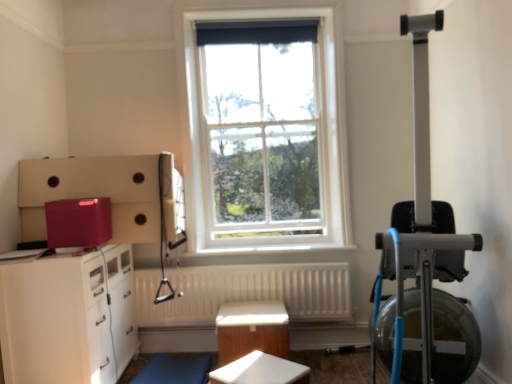
Question: Is white glossy cabinet at lower left shorter than white matte table at center, which is counted as the 2th table, starting from the back?

Choices:
 (A) yes
 (B) no

Answer: (B)

Question: Does white glossy cabinet at lower left have a smaller size compared to white matte table at center, marked as the 1th table in a front-to-back arrangement?

Choices:
 (A) yes
 (B) no

Answer: (B)

Question: Does white glossy cabinet at lower left have a lesser width compared to white matte table at center, marked as the 1th table in a front-to-back arrangement?

Choices:
 (A) no
 (B) yes

Answer: (A)

Question: Is the position of white glossy cabinet at lower left more distant than that of white matte table at center, marked as the 1th table in a front-to-back arrangement?

Choices:
 (A) yes
 (B) no

Answer: (A)

Question: Is white glossy cabinet at lower left positioned far away from white matte table at center, which is counted as the 2th table, starting from the back?

Choices:
 (A) no
 (B) yes

Answer: (A)

Question: From a real-world perspective, is white glossy cabinet at lower left below white matte table at center, which is counted as the 2th table, starting from the back?

Choices:
 (A) no
 (B) yes

Answer: (A)

Question: Is white matte table at center, marked as the 1th table in a front-to-back arrangement, not within wooden table at center, placed as the second table when sorted from front to back?

Choices:
 (A) no
 (B) yes

Answer: (B)

Question: Is white matte table at center, which is counted as the 2th table, starting from the back, in front of wooden table at center, arranged as the 1th table when viewed from the back?

Choices:
 (A) yes
 (B) no

Answer: (A)

Question: From the image's perspective, is white matte table at center, which is counted as the 2th table, starting from the back, located above wooden table at center, placed as the second table when sorted from front to back?

Choices:
 (A) yes
 (B) no

Answer: (B)

Question: From the image's perspective, is white matte table at center, marked as the 1th table in a front-to-back arrangement, beneath wooden table at center, placed as the second table when sorted from front to back?

Choices:
 (A) yes
 (B) no

Answer: (A)

Question: Is white matte table at center, marked as the 1th table in a front-to-back arrangement, taller than wooden table at center, placed as the second table when sorted from front to back?

Choices:
 (A) no
 (B) yes

Answer: (A)

Question: Is wooden table at center, placed as the second table when sorted from front to back, located within white matte table at center, marked as the 1th table in a front-to-back arrangement?

Choices:
 (A) no
 (B) yes

Answer: (A)

Question: Is white glossy cabinet at lower left wider than white glass window at center?

Choices:
 (A) yes
 (B) no

Answer: (A)